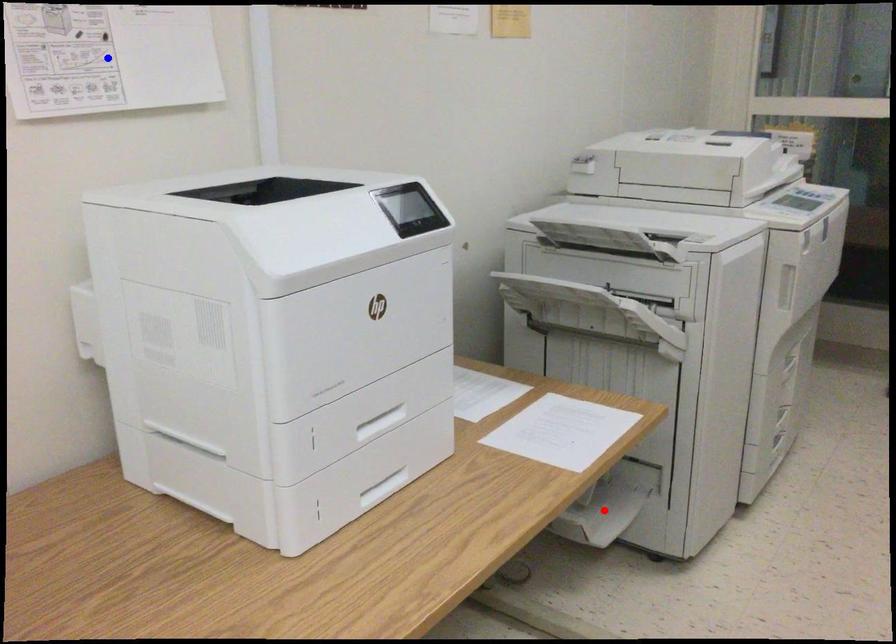
Question: Which of the two points in the image is closer to the camera?

Choices:
 (A) Blue point is closer.
 (B) Red point is closer.

Answer: (A)